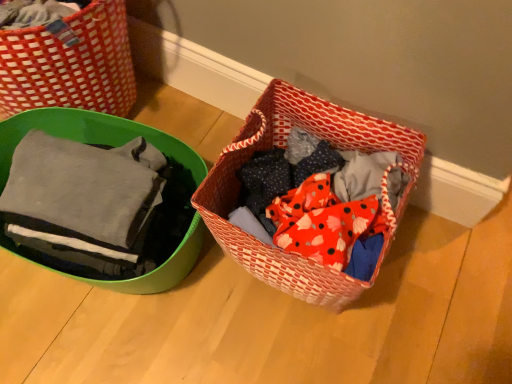
Question: Does red woven basket at center, the second picnic basket positioned from the left, have a lesser width compared to matte green bowl at left, marked as the second picnic basket in a right-to-left arrangement?

Choices:
 (A) no
 (B) yes

Answer: (B)

Question: Considering the relative positions of red woven basket at center, the 1th picnic basket in the right-to-left sequence, and matte green bowl at left, arranged as the 1th picnic basket when viewed from the left, in the image provided, is red woven basket at center, the 1th picnic basket in the right-to-left sequence, behind matte green bowl at left, arranged as the 1th picnic basket when viewed from the left,?

Choices:
 (A) yes
 (B) no

Answer: (B)

Question: Is red woven basket at center, the 1th picnic basket in the right-to-left sequence, not inside matte green bowl at left, marked as the second picnic basket in a right-to-left arrangement?

Choices:
 (A) no
 (B) yes

Answer: (B)

Question: From the image's perspective, is red woven basket at center, the 1th picnic basket in the right-to-left sequence, on top of matte green bowl at left, marked as the second picnic basket in a right-to-left arrangement?

Choices:
 (A) no
 (B) yes

Answer: (A)

Question: Considering the relative sizes of red woven basket at center, the second picnic basket positioned from the left, and matte green bowl at left, marked as the second picnic basket in a right-to-left arrangement, in the image provided, is red woven basket at center, the second picnic basket positioned from the left, bigger than matte green bowl at left, marked as the second picnic basket in a right-to-left arrangement,?

Choices:
 (A) yes
 (B) no

Answer: (B)

Question: Does red woven basket at center, the 1th picnic basket in the right-to-left sequence, have a smaller size compared to matte green bowl at left, marked as the second picnic basket in a right-to-left arrangement?

Choices:
 (A) yes
 (B) no

Answer: (A)

Question: Does red woven basket at center, the 1th picnic basket in the right-to-left sequence, have a greater height compared to matte gray fabric at left?

Choices:
 (A) yes
 (B) no

Answer: (A)

Question: From the image's perspective, would you say red woven basket at center, the 1th picnic basket in the right-to-left sequence, is positioned over matte gray fabric at left?

Choices:
 (A) no
 (B) yes

Answer: (A)

Question: From the image's perspective, would you say red woven basket at center, the 1th picnic basket in the right-to-left sequence, is shown under matte gray fabric at left?

Choices:
 (A) yes
 (B) no

Answer: (A)

Question: Considering the relative sizes of red woven basket at center, the second picnic basket positioned from the left, and matte gray fabric at left in the image provided, is red woven basket at center, the second picnic basket positioned from the left, thinner than matte gray fabric at left?

Choices:
 (A) yes
 (B) no

Answer: (B)

Question: From a real-world perspective, is red woven basket at center, the second picnic basket positioned from the left, on matte gray fabric at left?

Choices:
 (A) yes
 (B) no

Answer: (B)

Question: Is the depth of red woven basket at center, the 1th picnic basket in the right-to-left sequence, greater than that of matte gray fabric at left?

Choices:
 (A) no
 (B) yes

Answer: (B)

Question: From a real-world perspective, is matte gray fabric at left on matte green bowl at left, arranged as the 1th picnic basket when viewed from the left?

Choices:
 (A) yes
 (B) no

Answer: (A)